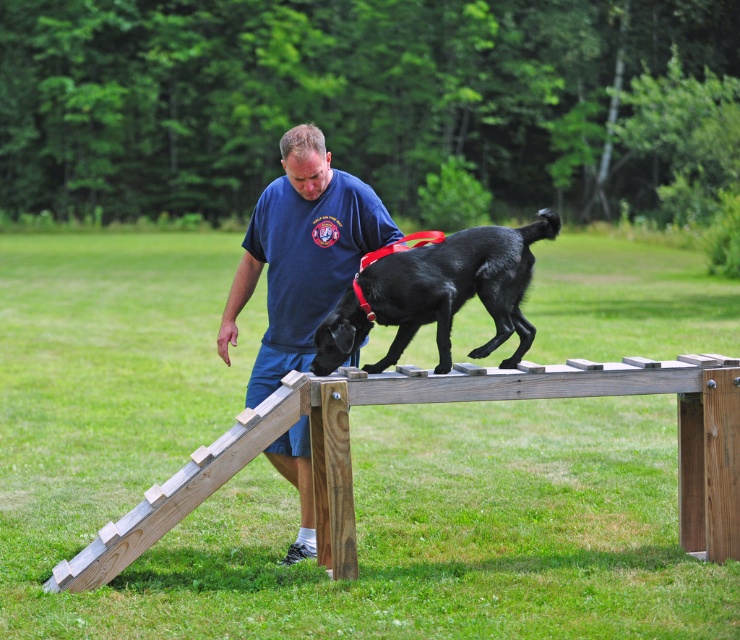
Question: Among these objects, which one is nearest to the camera?

Choices:
 (A) blue cotton shirt at center
 (B) shiny black dog at center

Answer: (B)

Question: In this image, where is wooden at center located relative to blue cotton shirt at center?

Choices:
 (A) below
 (B) above

Answer: (A)

Question: Which object appears closest to the camera in this image?

Choices:
 (A) wooden at center
 (B) shiny black dog at center
 (C) blue cotton shirt at center

Answer: (B)

Question: Can you confirm if wooden at center is positioned above shiny black dog at center?

Choices:
 (A) no
 (B) yes

Answer: (A)

Question: Does blue cotton shirt at center have a lesser width compared to shiny black dog at center?

Choices:
 (A) yes
 (B) no

Answer: (A)

Question: Which point is closer to the camera?

Choices:
 (A) blue cotton shirt at center
 (B) shiny black dog at center

Answer: (B)